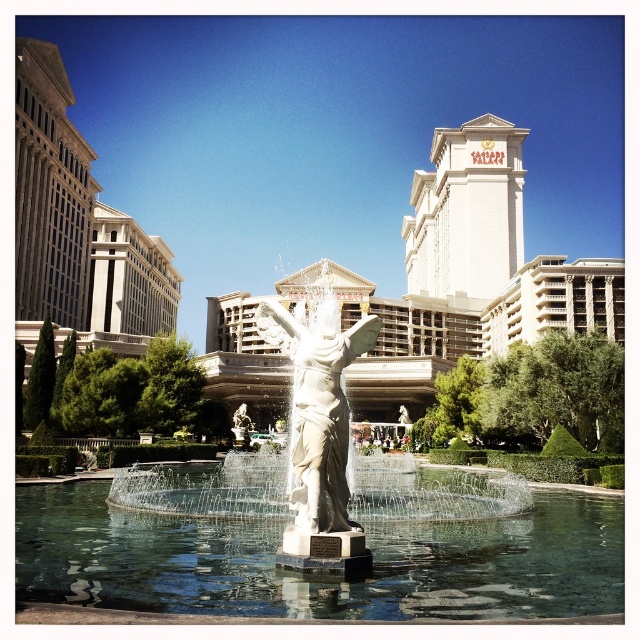
You are a photographer planning to capture the fountain and statue in the image. You want to ensure that both the clear glass water at center and the white marble statue at center are clearly visible in your shot. Given that your camera has a fixed focal length, which object should you prioritize framing closer to the center of the photo to ensure both are in focus?

The white marble statue at center should be prioritized closer to the center of the photo because it is larger than the clear glass water at center, making it more visually impactful and easier to keep in focus with a fixed focal length.

You are a maintenance worker tasked with cleaning the white marble statue at center. You notice that the clear glass water at center might interfere with your work. Is the statue above or below the water?

The white marble statue at center is above the clear glass water at center because the water is positioned under the statue.